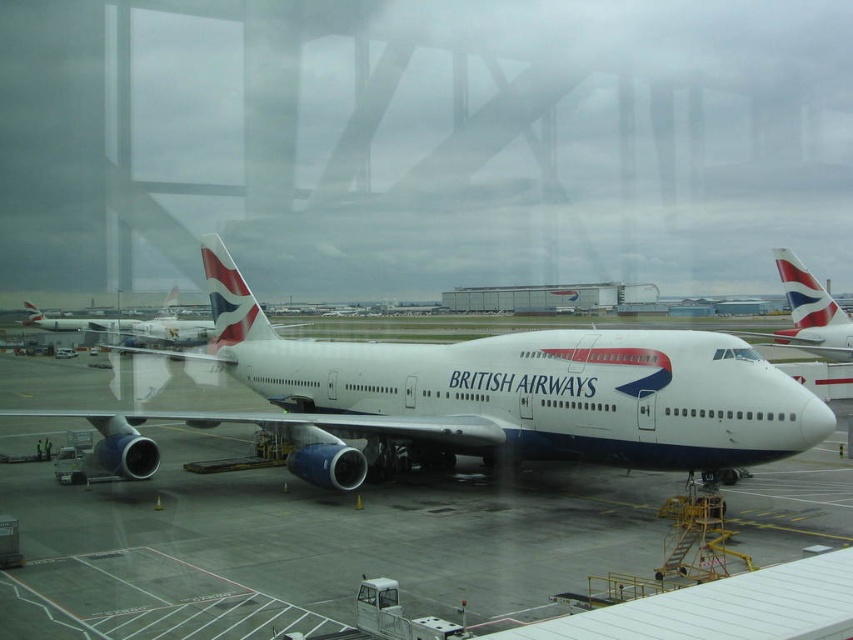
Question: Does white glossy airplane at center appear on the left side of white smooth tarmac at center?

Choices:
 (A) no
 (B) yes

Answer: (B)

Question: Which object appears farthest from the camera in this image?

Choices:
 (A) polished aluminum tail at center
 (B) white glossy airplane at center
 (C) white smooth tarmac at center
 (D) white glossy tail fin at center

Answer: (D)

Question: Can you confirm if white glossy airplane at center is thinner than white glossy tail fin at center?

Choices:
 (A) no
 (B) yes

Answer: (A)

Question: Does white smooth tarmac at center have a lesser width compared to white glossy tail fin at center?

Choices:
 (A) yes
 (B) no

Answer: (B)

Question: Which object is farther from the camera taking this photo?

Choices:
 (A) polished aluminum tail at center
 (B) white glossy airplane at center

Answer: (A)

Question: Which of the following is the farthest from the observer?

Choices:
 (A) (561, 420)
 (B) (827, 412)

Answer: (A)